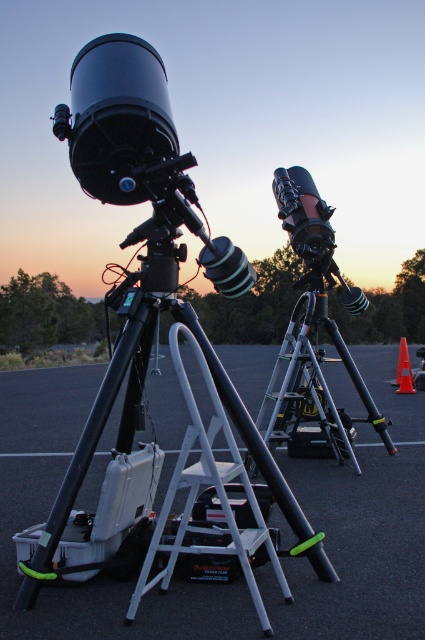
Is black plastic tripod at center bigger than orange plastic traffic cone at center right?

Yes, black plastic tripod at center is bigger than orange plastic traffic cone at center right.

Is black plastic tripod at center to the left of orange plastic traffic cone at center right from the viewer's perspective?

Yes, black plastic tripod at center is to the left of orange plastic traffic cone at center right.

What do you see at coordinates (360, 528) in the screenshot? I see `black plastic tripod at center` at bounding box center [360, 528].

This screenshot has height=640, width=425. I want to click on black plastic tripod at center, so click(360, 528).

Which is behind, point (2, 404) or point (399, 346)?

Point (399, 346)

Who is positioned more to the right, black plastic tripod at center or orange plastic traffic cone at right?

orange plastic traffic cone at right

Describe the element at coordinates (360, 528) in the screenshot. I see `black plastic tripod at center` at that location.

Identify the location of black plastic tripod at center. The image size is (425, 640). (360, 528).

The height and width of the screenshot is (640, 425). What do you see at coordinates (314, 387) in the screenshot? I see `black matte tripod at center` at bounding box center [314, 387].

Which is more to the right, black matte tripod at center or orange plastic traffic cone at center right?

Positioned to the right is orange plastic traffic cone at center right.

Is point (306, 428) farther from viewer compared to point (405, 388)?

That is False.

Where is `black matte tripod at center`? This screenshot has width=425, height=640. black matte tripod at center is located at coordinates (314, 387).